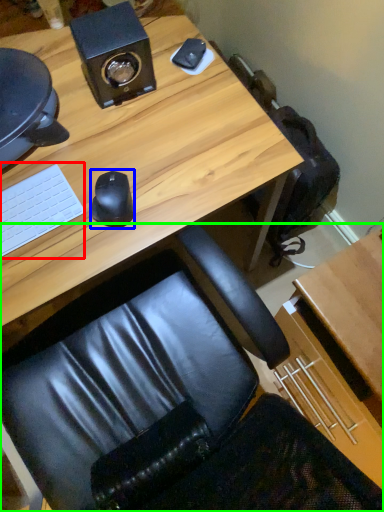
Question: Considering the real-world distances, which object is closest to laptop keyboard (highlighted by a red box)? mouse (highlighted by a blue box) or chair (highlighted by a green box).

Choices:
 (A) mouse
 (B) chair

Answer: (A)